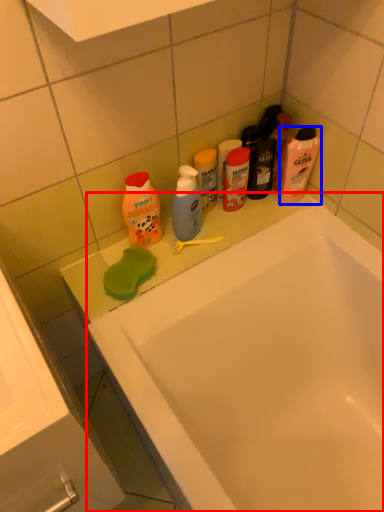
Question: Which object appears farthest to the camera in this image, bathtub (highlighted by a red box) or cleaning product (highlighted by a blue box)?

Choices:
 (A) bathtub
 (B) cleaning product

Answer: (B)